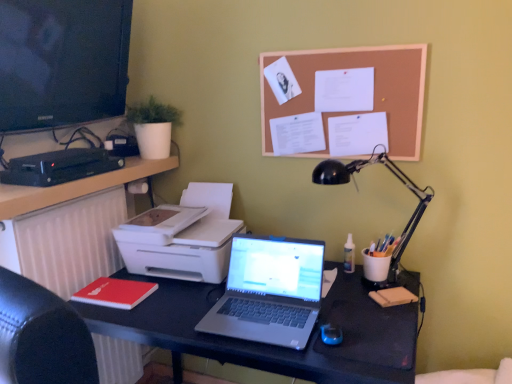
In order to click on free space in front of black metal desk lamp at right in this screenshot , I will do `click(370, 322)`.